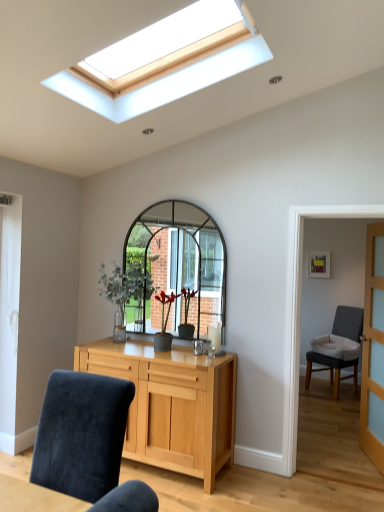
You are a GUI agent. You are given a task and a screenshot of the screen. Output one action in this format:
    pyautogui.click(x=<x>, y=<y>)
    Task: Click on the vacant space to the left of matte gray vase at center
    The width and height of the screenshot is (384, 512).
    Given the screenshot: What is the action you would take?
    pyautogui.click(x=139, y=349)